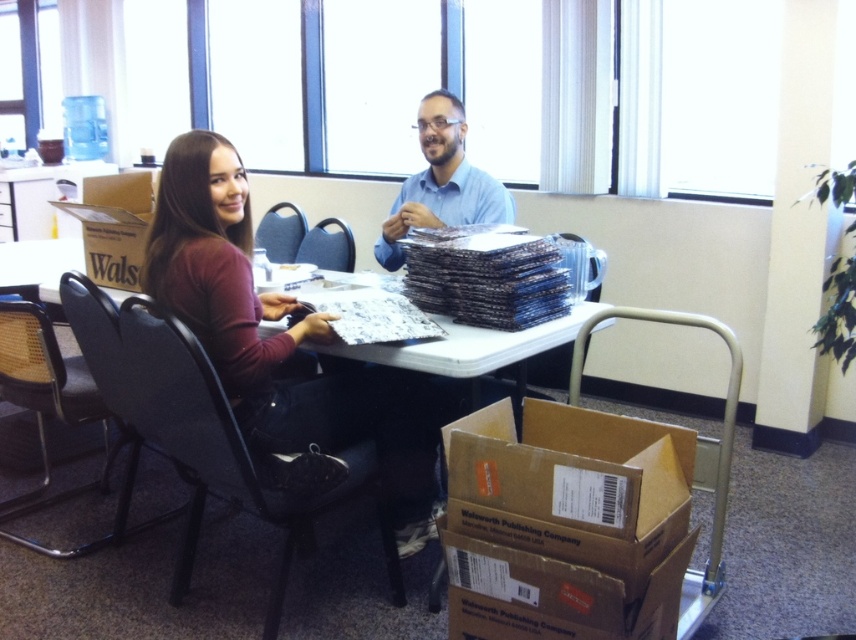
Between point (421, 211) and point (515, 337), which one is positioned in front?

Point (515, 337) is more forward.

Where is `blue shirt at center`? This screenshot has width=856, height=640. blue shirt at center is located at coordinates (441, 182).

I want to click on blue shirt at center, so click(x=441, y=182).

Can you confirm if brown cardboard box at lower right is smaller than matte maroon shirt at center?

Correct, brown cardboard box at lower right occupies less space than matte maroon shirt at center.

Measure the distance from brown cardboard box at lower right to matte maroon shirt at center.

brown cardboard box at lower right and matte maroon shirt at center are 26.84 inches apart.

The image size is (856, 640). I want to click on brown cardboard box at lower right, so click(565, 516).

Can you confirm if brown cardboard box at lower right is thinner than brown cardboard table at center?

Correct, brown cardboard box at lower right's width is less than brown cardboard table at center's.

Who is positioned more to the left, brown cardboard box at lower right or brown cardboard table at center?

brown cardboard table at center

Is point (497, 621) behind point (437, 352)?

No, it is not.

You are a GUI agent. You are given a task and a screenshot of the screen. Output one action in this format:
    pyautogui.click(x=<x>, y=<y>)
    Task: Click on the brown cardboard box at lower right
    The width and height of the screenshot is (856, 640).
    Given the screenshot: What is the action you would take?
    pyautogui.click(x=565, y=516)